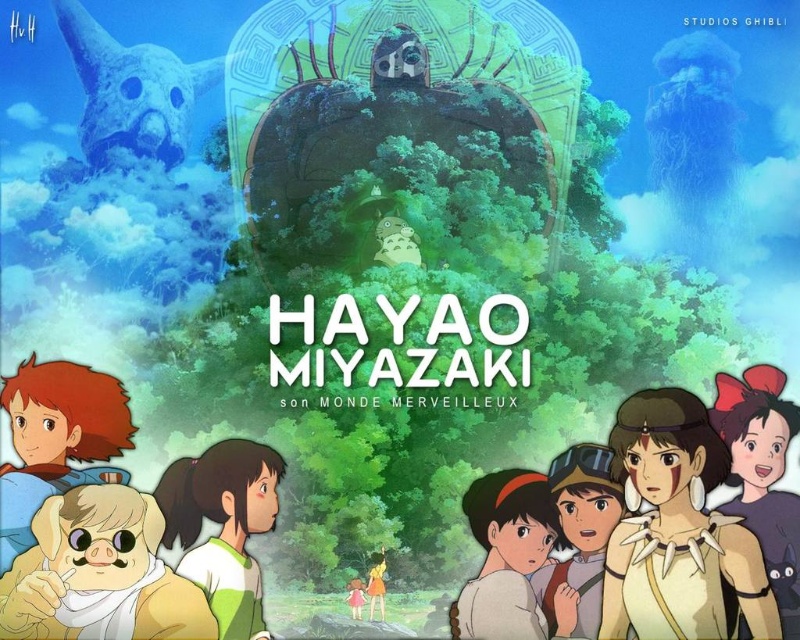
Question: Estimate the real-world distances between objects in this image. Which object is farther from the green matte shirt at center?

Choices:
 (A) brown leather armor at center
 (B) smooth brown jacket at center
 (C) smooth brown hair at right

Answer: (C)

Question: In this image, where is soft yellow fur at lower left located relative to smooth beige dress at center?

Choices:
 (A) right
 (B) left

Answer: (B)

Question: Which point appears farthest from the camera in this image?

Choices:
 (A) (225, 532)
 (B) (709, 412)
 (C) (762, 625)
 (D) (54, 572)

Answer: (B)

Question: Which point is closer to the camera?

Choices:
 (A) (632, 481)
 (B) (354, 600)

Answer: (B)

Question: Does brown leather armor at center appear on the right side of brown fur dog at lower left?

Choices:
 (A) no
 (B) yes

Answer: (B)

Question: Can you confirm if smooth brown hair at right is positioned to the left of smooth brown jacket at center?

Choices:
 (A) yes
 (B) no

Answer: (B)